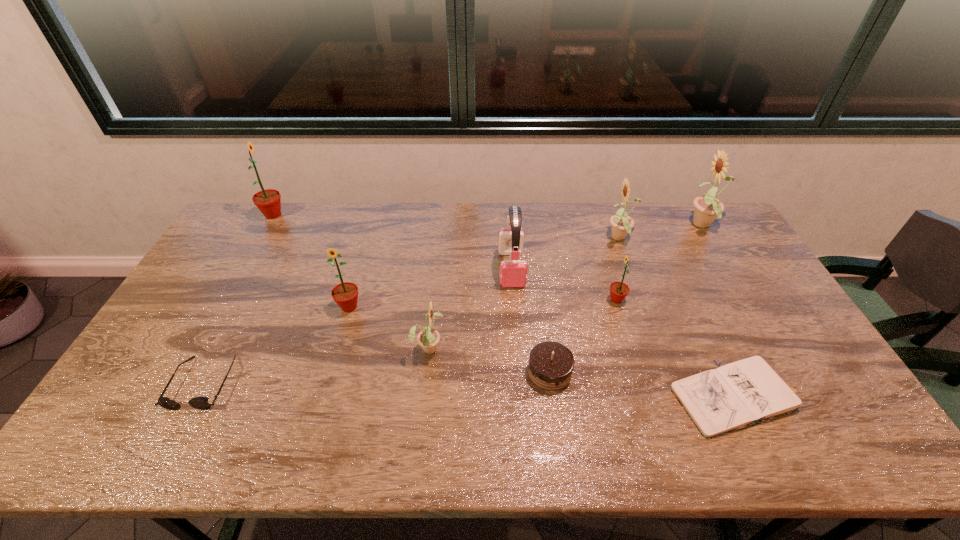
At what (x,y) coordinates should I click in order to perform the action: click on vacant point located between the second shortest object and the earphone. Please return your answer as a coordinate pair (x, y). Looking at the image, I should click on click(x=357, y=326).

This screenshot has height=540, width=960. What are the coordinates of `free space that is in between the smallest yellow sunflower and the second biggest yellow sunflower` in the screenshot? It's located at [x=524, y=293].

Locate an element on the screen. The image size is (960, 540). vacant point located between the ninth tallest object and the nearest sunflower is located at coordinates (316, 365).

Identify which object is the eighth nearest to the notebook. Please provide its 2D coordinates. Your answer should be formatted as a tuple, i.e. [(x, y)], where the tuple contains the x and y coordinates of a point satisfying the conditions above.

[(201, 403)]

Select which object appears as the third closest to the shortest object. Please provide its 2D coordinates. Your answer should be formatted as a tuple, i.e. [(x, y)], where the tuple contains the x and y coordinates of a point satisfying the conditions above.

[(512, 273)]

Locate an element on the screen. sunflower that stands as the third closest to the seventh nearest object is located at coordinates (622, 224).

Identify the location of the fourth closest sunflower to the second yellow sunflower from left to right. This screenshot has height=540, width=960. (345, 294).

Select which yellow sunflower appears as the second closest to the rightmost sunflower. Please provide its 2D coordinates. Your answer should be formatted as a tuple, i.e. [(x, y)], where the tuple contains the x and y coordinates of a point satisfying the conditions above.

[(428, 338)]

You are a GUI agent. You are given a task and a screenshot of the screen. Output one action in this format:
    pyautogui.click(x=<x>, y=<y>)
    Task: Click on the third closest yellow sunflower to the shortest object
    This screenshot has width=960, height=540.
    Given the screenshot: What is the action you would take?
    pyautogui.click(x=428, y=338)

Where is `the third closest green sunflower relative to the chocolate cake`? This screenshot has width=960, height=540. the third closest green sunflower relative to the chocolate cake is located at coordinates (268, 201).